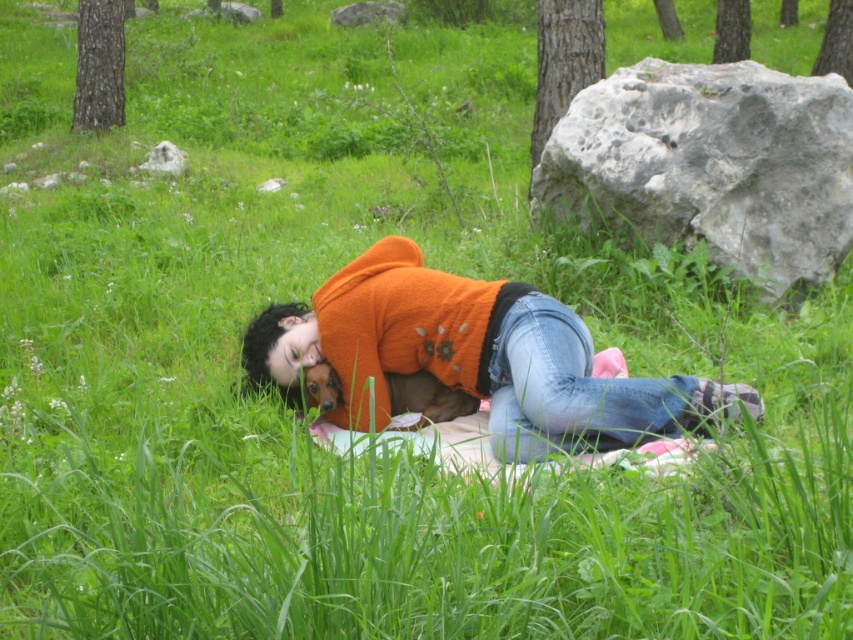
You are standing at the edge of the grassy area and want to take a photo of the gray rough rock at upper right and the gray rough rock at upper center. Which rock should you focus on first to ensure both are in the frame without moving the camera?

You should focus on the gray rough rock at upper center first because it is behind the gray rough rock at upper right, so adjusting the camera to include the one further back will naturally include the one in front as well.

You are a photographer standing in the scene and want to take a photo of the gray rough rock at upper right and the orange fleece sweater at center. Which object should you adjust your camera focus on first if you want to ensure both are in focus?

The gray rough rock at upper right is further to the viewer than the orange fleece sweater at center, so you should focus on the gray rough rock at upper right first to ensure both are in focus.

You are standing in the grassy area and want to throw a ball to the gray rough rock at upper right. If your throwing range is 15 feet, will you be able to reach it?

The gray rough rock at upper right is 18.17 feet away from you, which is beyond your throwing range of 15 feet. You won t be able to reach it.